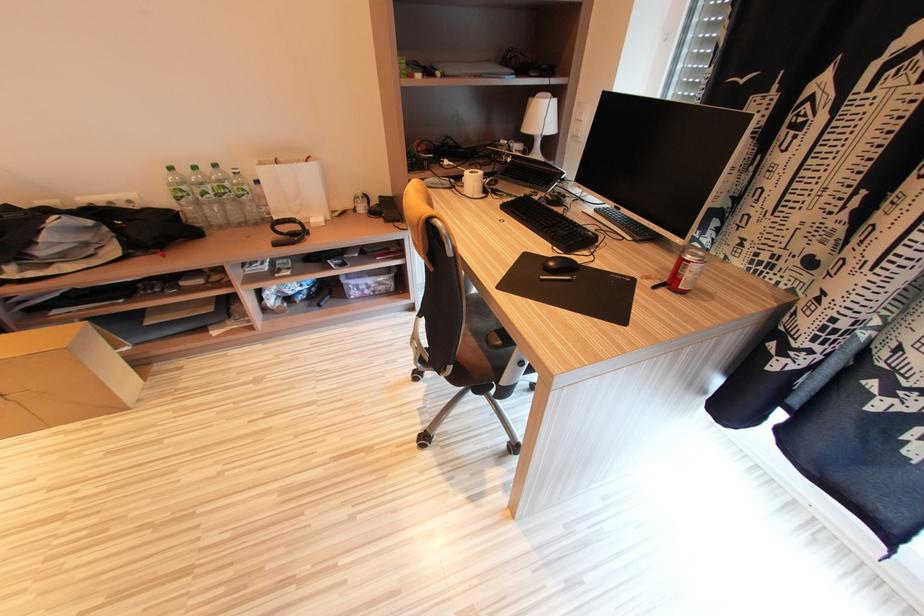
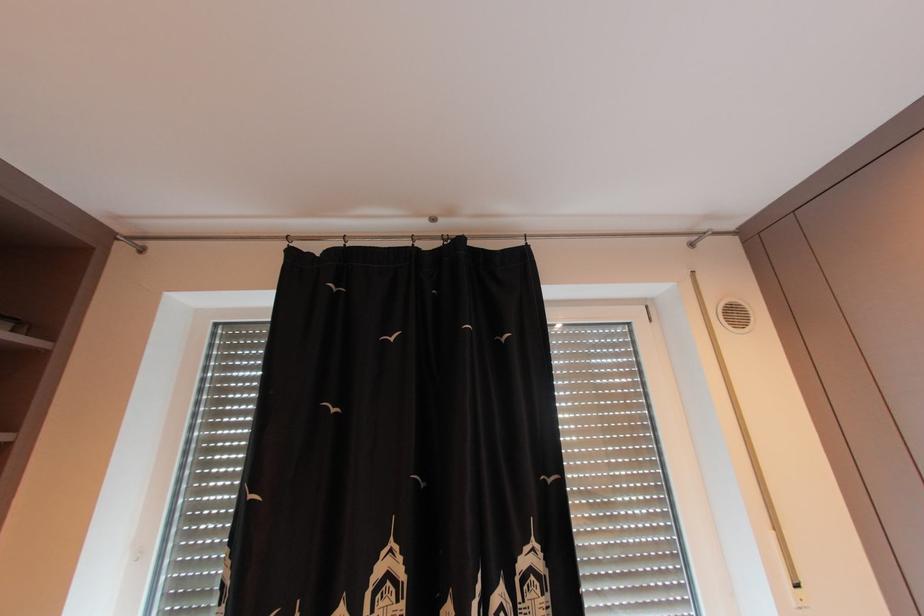
First-person continuous shooting, in which direction is the camera rotating?

The camera's rotation is toward right-up.